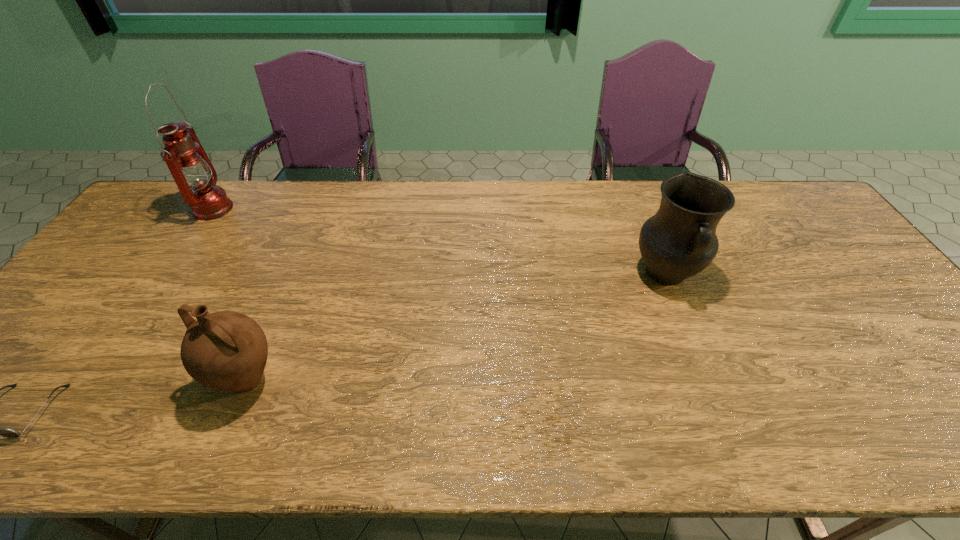
Where is `the second closest object to the right pitcher`? The width and height of the screenshot is (960, 540). the second closest object to the right pitcher is located at coordinates (192, 170).

Identify which object is the third nearest to the left pitcher. Please provide its 2D coordinates. Your answer should be formatted as a tuple, i.e. [(x, y)], where the tuple contains the x and y coordinates of a point satisfying the conditions above.

[(679, 241)]

At what (x,y) coordinates should I click in order to perform the action: click on vacant space that satisfies the following two spatial constraints: 1. on the front side of the third object from left to right; 2. on the right side of the tallest object. Please return your answer as a coordinate pair (x, y). The height and width of the screenshot is (540, 960). Looking at the image, I should click on (96, 381).